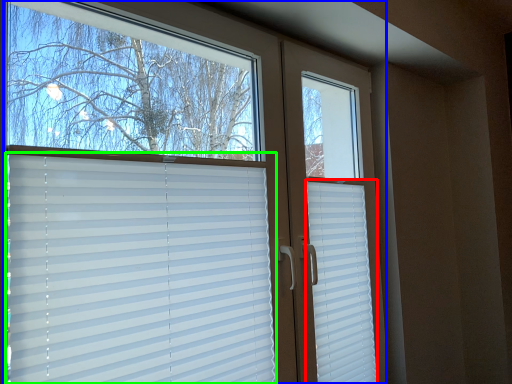
Question: Estimate the real-world distances between objects in this image. Which object is farther from shutter (highlighted by a red box), window (highlighted by a blue box) or window blind (highlighted by a green box)?

Choices:
 (A) window
 (B) window blind

Answer: (B)